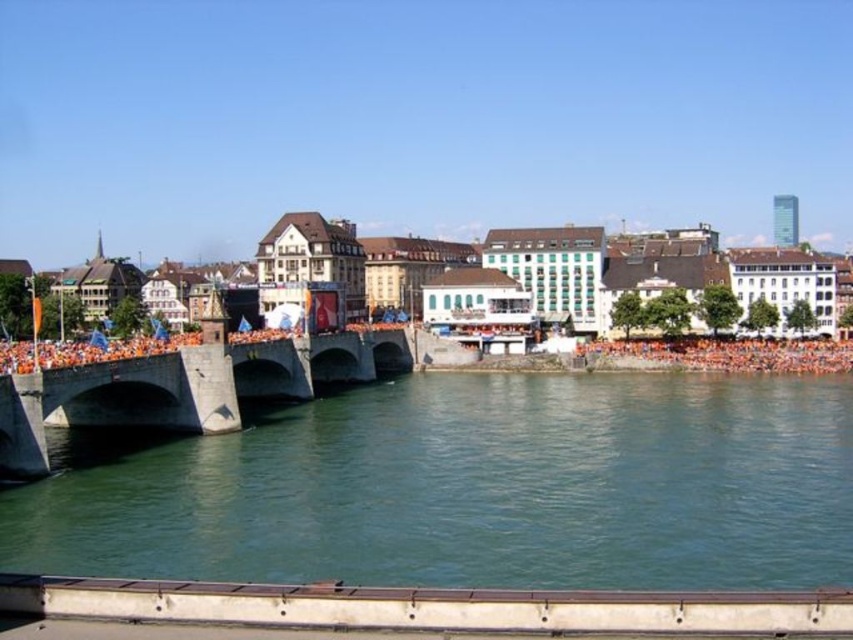
You are standing on the concrete bridge at center and want to cross to the orange cloth crowd at lower right. Which direction should you walk to reach them?

You should walk to the right because the orange cloth crowd at lower right is to the right of the concrete bridge at center.

You are a photographer planning to take a photo of the concrete bridge at center and the orange cloth crowd at lower right from a position on the left side of the river. Considering the height difference between the two, which object will appear larger in the photo?

The concrete bridge at center will appear larger in the photo because it is much taller than the orange cloth crowd at lower right.